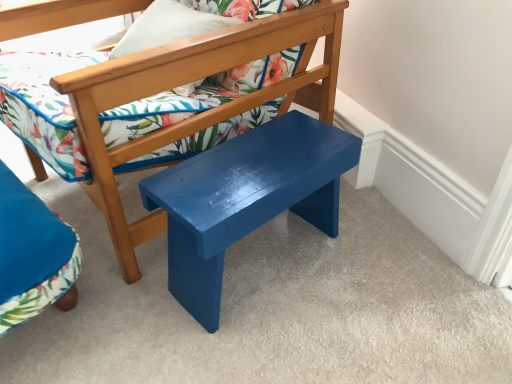
Where is `free space above glossy wood stool at center (from a real-world perspective)`? This screenshot has width=512, height=384. free space above glossy wood stool at center (from a real-world perspective) is located at coordinates (263, 154).